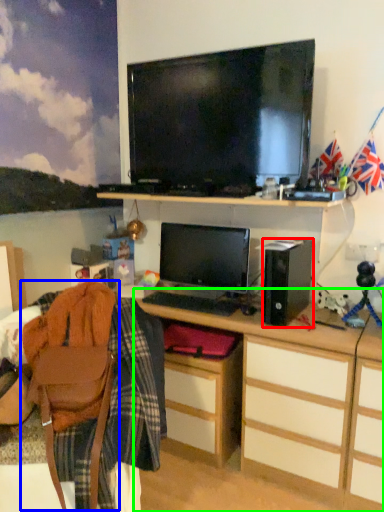
Question: Considering the real-world distances, which object is closest to speaker (highlighted by a red box)? swivel chair (highlighted by a blue box) or desk (highlighted by a green box).

Choices:
 (A) swivel chair
 (B) desk

Answer: (B)